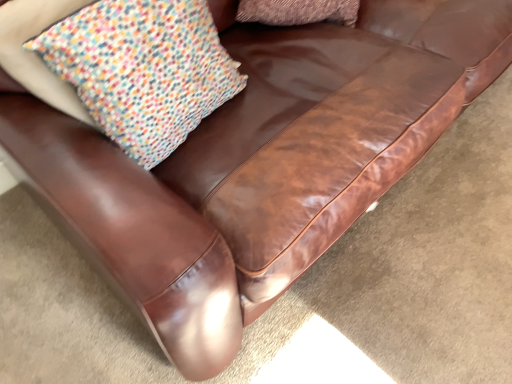
The image size is (512, 384). What do you see at coordinates (143, 70) in the screenshot?
I see `multicolored woven pillow at upper left` at bounding box center [143, 70].

Measure the distance between point (88,66) and camera.

The depth of point (88,66) is 31.18 inches.

This screenshot has width=512, height=384. In order to click on multicolored woven pillow at upper left in this screenshot , I will do `click(143, 70)`.

You are a GUI agent. You are given a task and a screenshot of the screen. Output one action in this format:
    pyautogui.click(x=<x>, y=<y>)
    Task: Click on the multicolored woven pillow at upper left
    Image resolution: width=512 pixels, height=384 pixels.
    Given the screenshot: What is the action you would take?
    pyautogui.click(x=143, y=70)